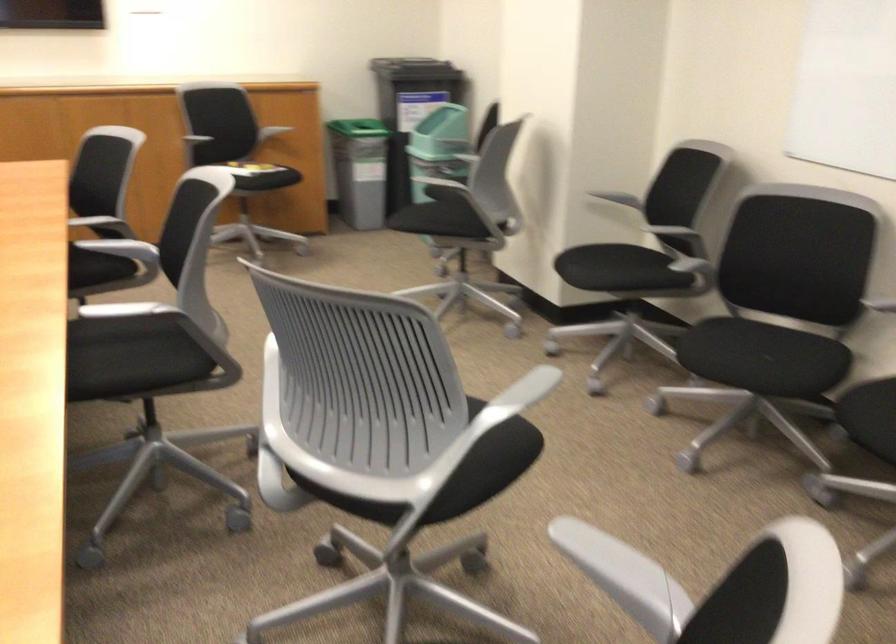
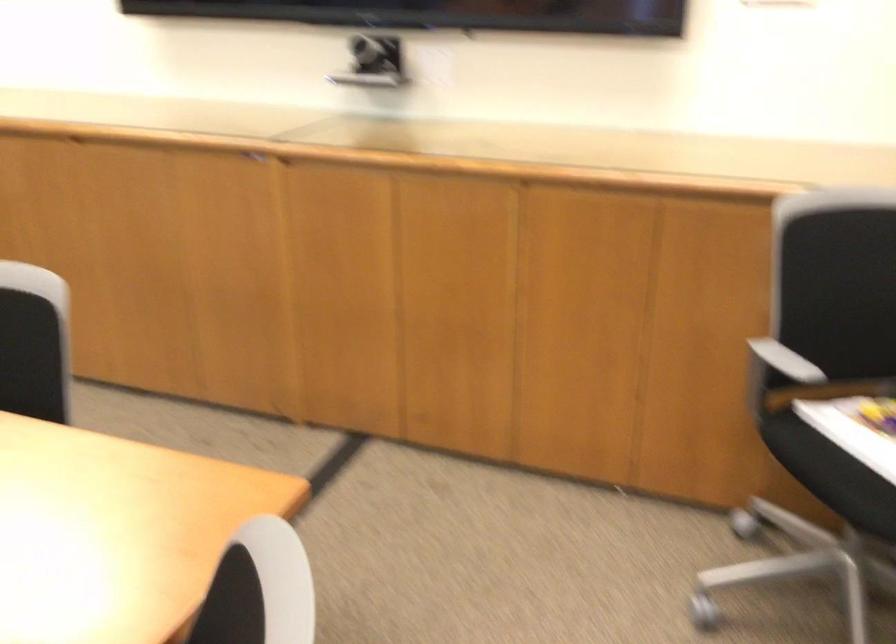
Where in the second image is the point corresponding to [234,149] from the first image?

(857, 428)